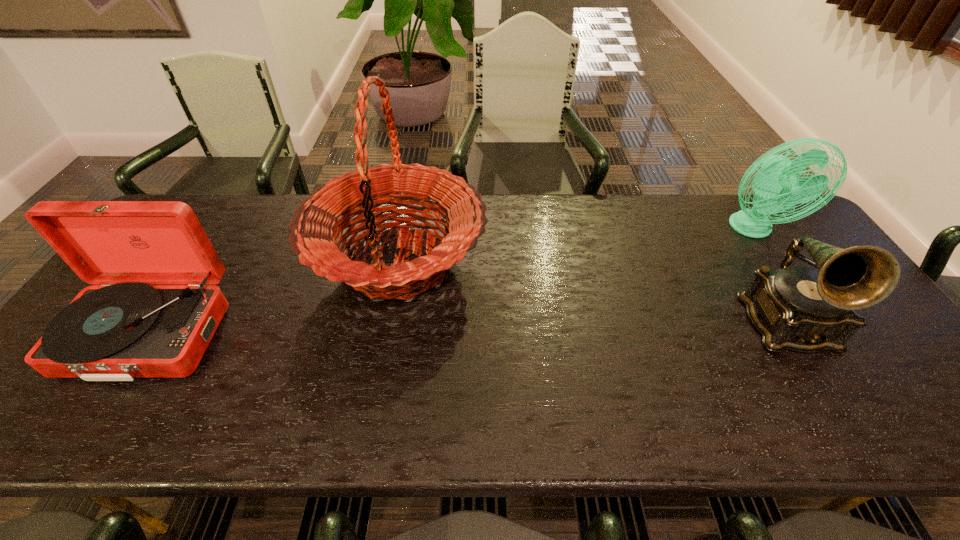
Find the location of a particular element. The image size is (960, 540). the tallest object is located at coordinates (315, 228).

Find the location of a particular element. This screenshot has height=540, width=960. the second object from left to right is located at coordinates (315, 228).

Where is `the right phonograph_record`? This screenshot has width=960, height=540. the right phonograph_record is located at coordinates (795, 308).

The width and height of the screenshot is (960, 540). Identify the location of fan. 777,184.

Locate an element on the screen. The width and height of the screenshot is (960, 540). the leftmost object is located at coordinates (124, 329).

Identify the location of vacant space situated on the right of the basket. (578, 261).

Locate an element on the screen. free region located 0.070m on the horn of the right phonograph_record is located at coordinates (830, 397).

You are a GUI agent. You are given a task and a screenshot of the screen. Output one action in this format:
    pyautogui.click(x=<x>, y=<y>)
    Task: Click on the vacant space located in front of the fan to blow air
    The height and width of the screenshot is (540, 960).
    Given the screenshot: What is the action you would take?
    coord(838,358)

The height and width of the screenshot is (540, 960). Find the location of `vacant region located 0.110m on the front-facing side of the leftmost object`. vacant region located 0.110m on the front-facing side of the leftmost object is located at coordinates (84, 434).

Where is `basket located in the far edge section of the desktop`? The image size is (960, 540). basket located in the far edge section of the desktop is located at coordinates (315, 228).